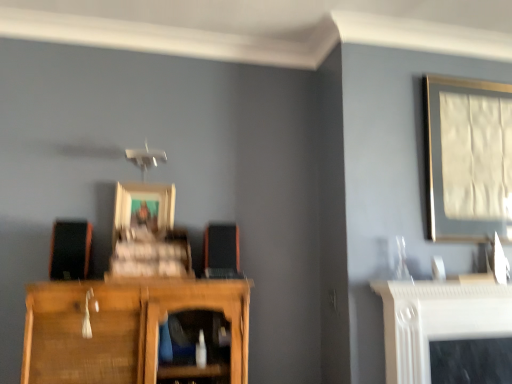
Question: Is matte silver picture frame at upper right, arranged as the 1th picture frame when viewed from the right, looking in the opposite direction of orange matte speaker at center, which ranks as the first speaker in right-to-left order?

Choices:
 (A) yes
 (B) no

Answer: (B)

Question: Does matte silver picture frame at upper right, arranged as the 1th picture frame when viewed from the right, have a lesser width compared to orange matte speaker at center, which ranks as the first speaker in right-to-left order?

Choices:
 (A) yes
 (B) no

Answer: (A)

Question: Considering the relative sizes of matte silver picture frame at upper right, the second picture frame when ordered from left to right, and orange matte speaker at center, the 2th speaker in the left-to-right sequence, in the image provided, is matte silver picture frame at upper right, the second picture frame when ordered from left to right, taller than orange matte speaker at center, the 2th speaker in the left-to-right sequence,?

Choices:
 (A) no
 (B) yes

Answer: (B)

Question: Would you say matte silver picture frame at upper right, the second picture frame when ordered from left to right, contains orange matte speaker at center, the 2th speaker in the left-to-right sequence?

Choices:
 (A) yes
 (B) no

Answer: (B)

Question: From the image's perspective, is matte silver picture frame at upper right, arranged as the 1th picture frame when viewed from the right, below orange matte speaker at center, which ranks as the first speaker in right-to-left order?

Choices:
 (A) no
 (B) yes

Answer: (A)

Question: Is matte silver picture frame at upper right, the second picture frame when ordered from left to right, positioned far away from orange matte speaker at center, which ranks as the first speaker in right-to-left order?

Choices:
 (A) yes
 (B) no

Answer: (A)

Question: Is wooden picture frame at center, which ranks as the 2th picture frame in right-to-left order, thinner than matte black speaker at left, the second speaker in the right-to-left sequence?

Choices:
 (A) no
 (B) yes

Answer: (B)

Question: Considering the relative positions of wooden picture frame at center, which ranks as the 2th picture frame in right-to-left order, and matte black speaker at left, the second speaker in the right-to-left sequence, in the image provided, is wooden picture frame at center, which ranks as the 2th picture frame in right-to-left order, behind matte black speaker at left, the second speaker in the right-to-left sequence,?

Choices:
 (A) no
 (B) yes

Answer: (B)

Question: From a real-world perspective, is wooden picture frame at center, which ranks as the 2th picture frame in right-to-left order, positioned under matte black speaker at left, the second speaker in the right-to-left sequence, based on gravity?

Choices:
 (A) no
 (B) yes

Answer: (A)

Question: Considering the relative positions of wooden picture frame at center, placed as the first picture frame when sorted from left to right, and matte black speaker at left, acting as the first speaker starting from the left, in the image provided, is wooden picture frame at center, placed as the first picture frame when sorted from left to right, in front of matte black speaker at left, acting as the first speaker starting from the left,?

Choices:
 (A) yes
 (B) no

Answer: (B)

Question: Does wooden picture frame at center, which ranks as the 2th picture frame in right-to-left order, turn towards matte black speaker at left, acting as the first speaker starting from the left?

Choices:
 (A) no
 (B) yes

Answer: (A)

Question: Is wooden picture frame at center, which ranks as the 2th picture frame in right-to-left order, far away from matte black speaker at left, the second speaker in the right-to-left sequence?

Choices:
 (A) yes
 (B) no

Answer: (B)

Question: Is matte black speaker at left, the second speaker in the right-to-left sequence, next to wooden picture frame at center, placed as the first picture frame when sorted from left to right, and touching it?

Choices:
 (A) no
 (B) yes

Answer: (A)